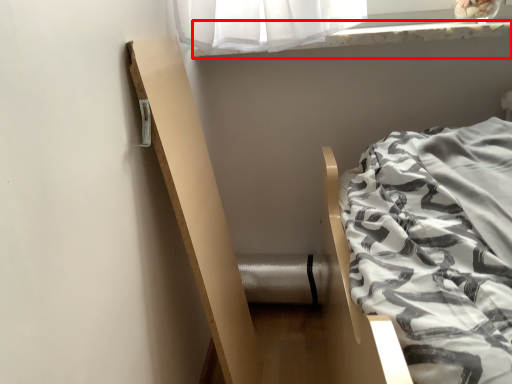
Question: From the image's perspective, what is the correct spatial relationship of window sill (annotated by the red box) in relation to balustrade?

Choices:
 (A) above
 (B) below

Answer: (A)